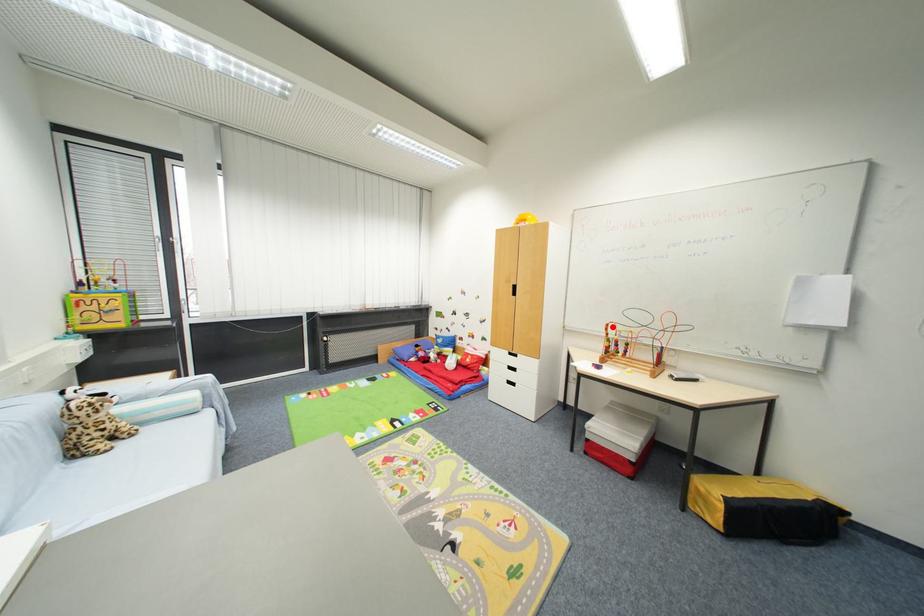
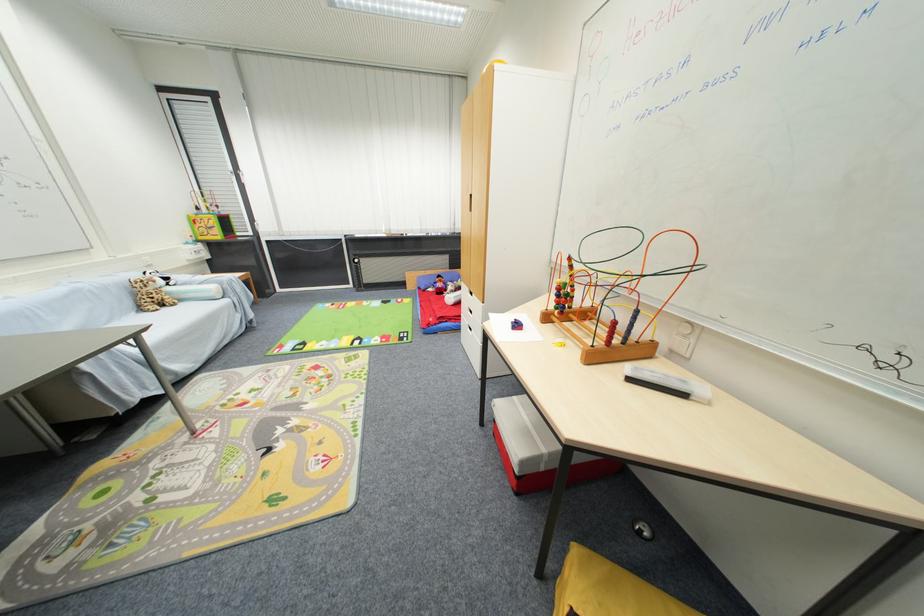
Locate, in the second image, the point that corresponds to the highlighted location in the first image.

(575, 261)